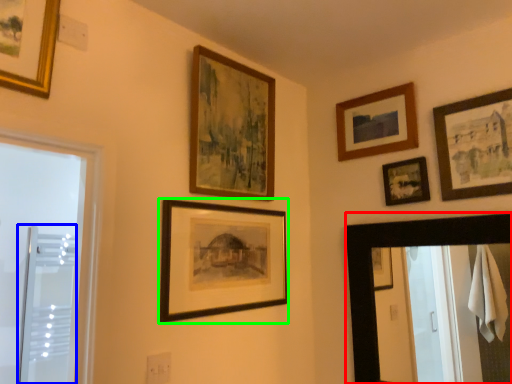
Question: Which is nearer to the mirror (highlighted by a red box)? screen door (highlighted by a blue box) or picture frame (highlighted by a green box).

Choices:
 (A) screen door
 (B) picture frame

Answer: (B)